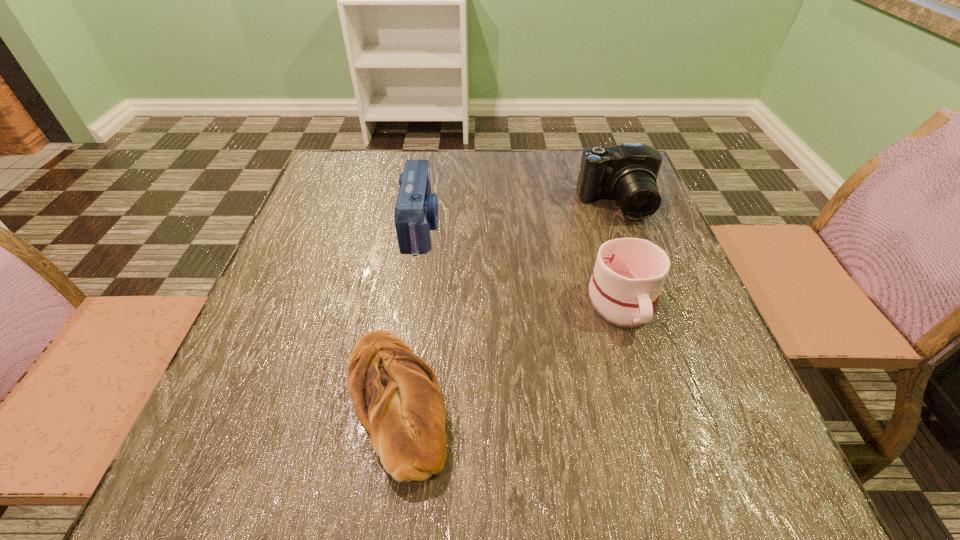
Where is `vacant point that satisfies the following two spatial constraints: 1. on the lens of the bread; 2. on the right side of the left camera`? This screenshot has height=540, width=960. vacant point that satisfies the following two spatial constraints: 1. on the lens of the bread; 2. on the right side of the left camera is located at coordinates [x=396, y=402].

Locate an element on the screen. This screenshot has width=960, height=540. vacant space that satisfies the following two spatial constraints: 1. on the back side of the shortest object; 2. on the lens of the left camera is located at coordinates pyautogui.click(x=422, y=227).

At what (x,y) coordinates should I click in order to perform the action: click on free location that satisfies the following two spatial constraints: 1. on the lens of the left camera; 2. on the left side of the bread. Please return your answer as a coordinate pair (x, y). Looking at the image, I should click on (396, 402).

Identify the location of free space that satisfies the following two spatial constraints: 1. on the lens of the right camera; 2. on the lens of the left camera. (625, 227).